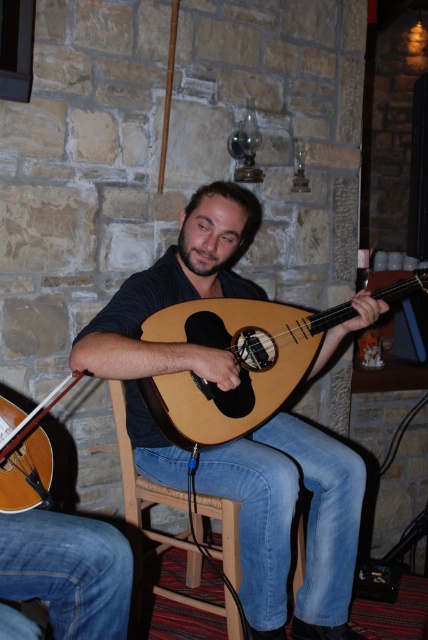
Question: Can you confirm if matte brown mandolin at center is positioned below wooden chair at center?

Choices:
 (A) yes
 (B) no

Answer: (B)

Question: Can you confirm if natural wood mandolin at center is thinner than wooden chair at center?

Choices:
 (A) yes
 (B) no

Answer: (B)

Question: Which object is the closest to the natural wood mandolin at center?

Choices:
 (A) matte brown mandolin at center
 (B) matte brown violin at lower left
 (C) wooden chair at center

Answer: (A)

Question: Which object appears closest to the camera in this image?

Choices:
 (A) natural wood mandolin at center
 (B) wooden chair at center

Answer: (A)

Question: Which point is farther to the camera?

Choices:
 (A) natural wood mandolin at center
 (B) matte brown mandolin at center

Answer: (A)

Question: Is natural wood mandolin at center in front of matte brown violin at lower left?

Choices:
 (A) no
 (B) yes

Answer: (A)